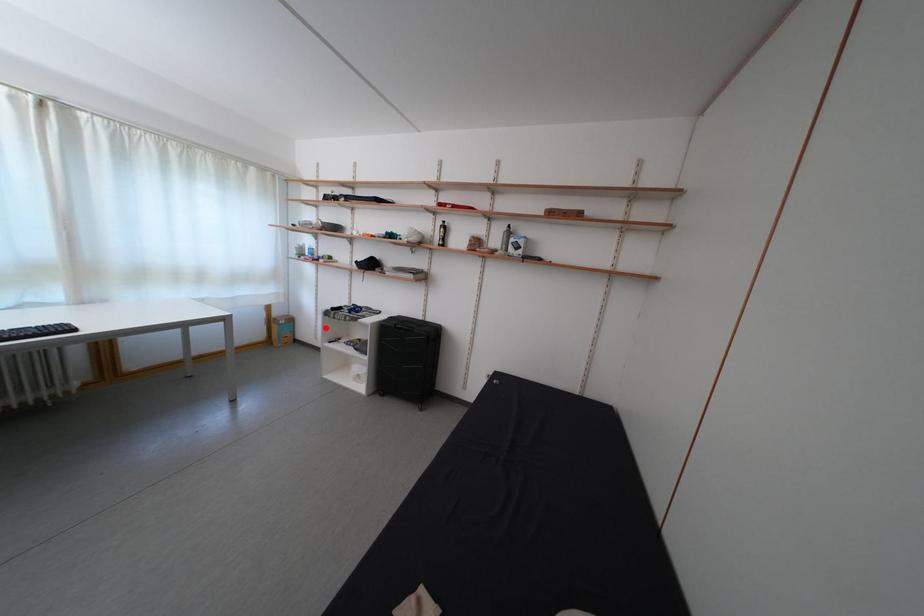
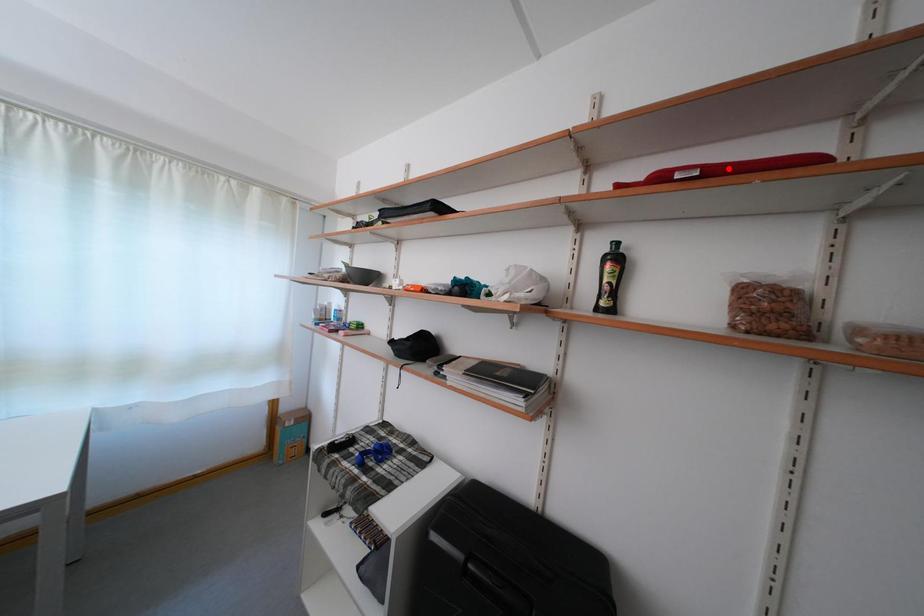
I am providing you with two images of the same scene from different viewpoints. A red point is marked on the first image and another point is marked on the second image. Is the red point in image1 aligned with the point shown in image2?

No